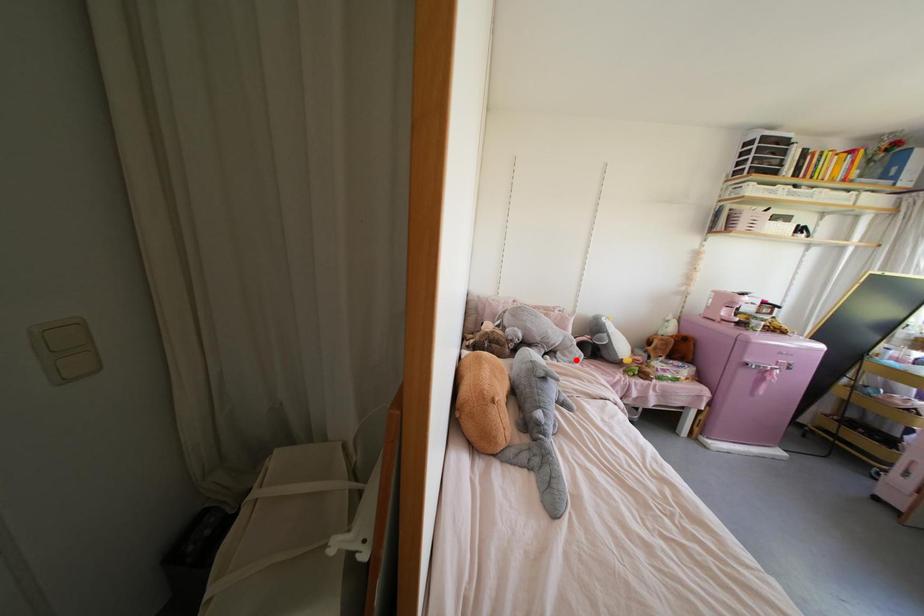
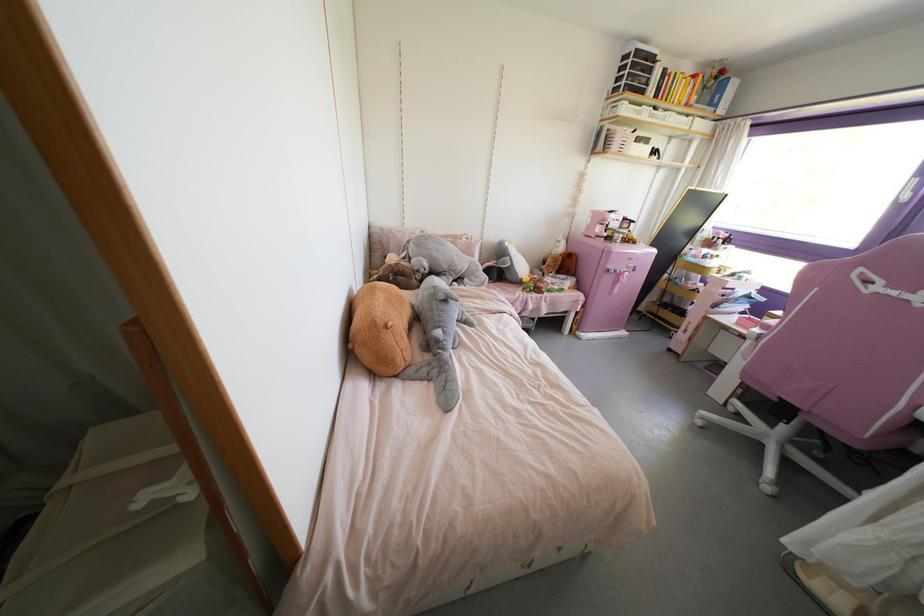
The point at the highlighted location is marked in the first image. Where is the corresponding point in the second image?

(482, 284)